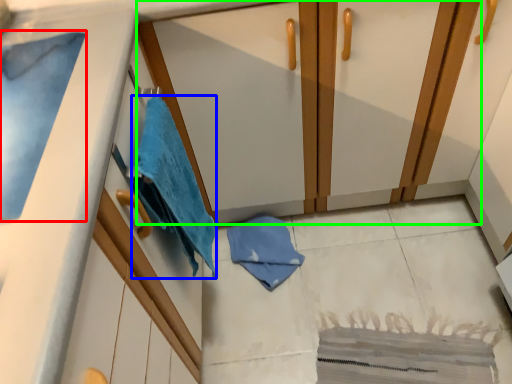
Question: Estimate the real-world distances between objects in this image. Which object is farther from bath towel (highlighted by a red box), beach towel (highlighted by a blue box) or dresser (highlighted by a green box)?

Choices:
 (A) beach towel
 (B) dresser

Answer: (B)